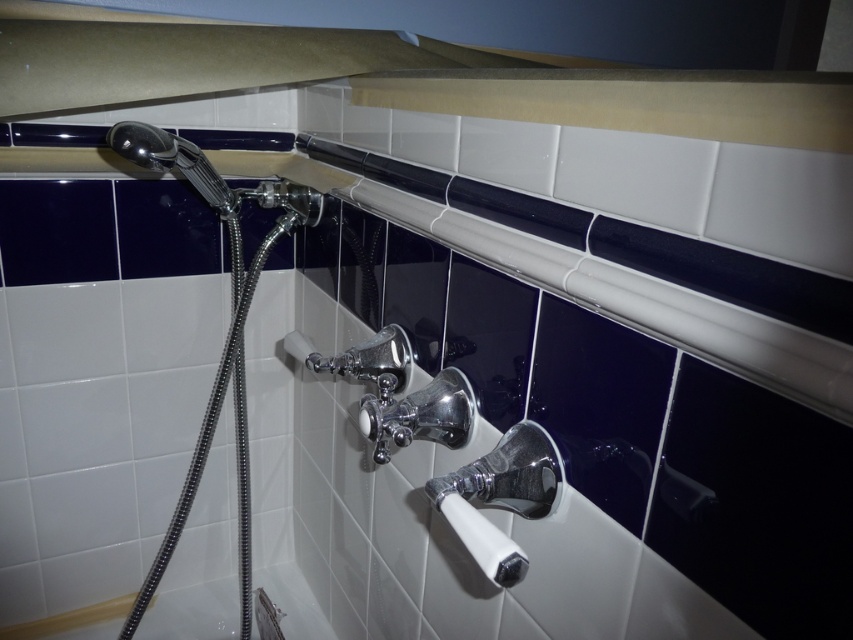
Question: Can you confirm if white glossy bath at lower left is positioned to the right of shiny chrome shower head at upper left?

Choices:
 (A) yes
 (B) no

Answer: (B)

Question: Can you confirm if white glossy bath at lower left is positioned to the right of shiny chrome shower head at upper left?

Choices:
 (A) no
 (B) yes

Answer: (A)

Question: Which point is farther to the camera?

Choices:
 (A) (55, 632)
 (B) (120, 134)

Answer: (A)

Question: Which of the following is the farthest from the observer?

Choices:
 (A) white glossy bath at lower left
 (B) shiny chrome shower head at upper left

Answer: (A)

Question: Can you confirm if white glossy bath at lower left is positioned to the right of shiny chrome shower head at upper left?

Choices:
 (A) yes
 (B) no

Answer: (B)